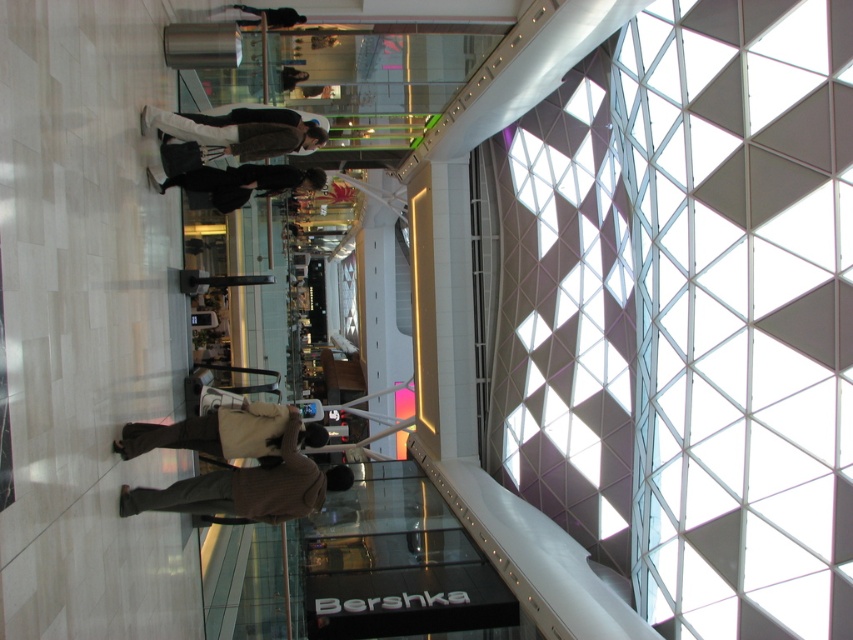
Question: Which object is positioned farthest from the dark brown leather jacket at center?

Choices:
 (A) brown wool sweater at center
 (B) brown wool coat at center

Answer: (A)

Question: Which point is farther to the camera?

Choices:
 (A) brown wool coat at center
 (B) brown wool sweater at center
 (C) dark brown leather jacket at center

Answer: (C)

Question: Does brown wool sweater at center have a lesser width compared to dark brown leather jacket at center?

Choices:
 (A) yes
 (B) no

Answer: (B)

Question: Among these points, which one is nearest to the camera?

Choices:
 (A) (256, 445)
 (B) (221, 493)

Answer: (A)

Question: Does brown wool sweater at center have a greater width compared to brown wool coat at center?

Choices:
 (A) yes
 (B) no

Answer: (A)

Question: Does brown wool sweater at center appear over dark brown leather jacket at center?

Choices:
 (A) yes
 (B) no

Answer: (B)